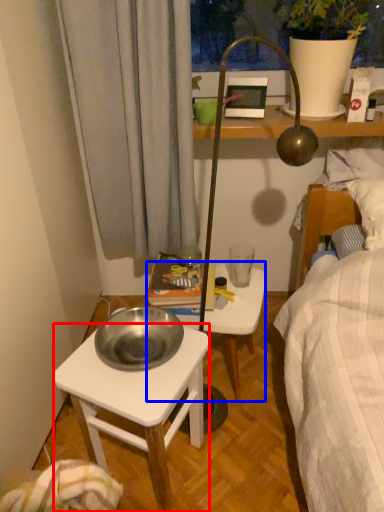
Question: Which object appears farthest to the camera in this image, desk (highlighted by a red box) or stool (highlighted by a blue box)?

Choices:
 (A) desk
 (B) stool

Answer: (B)